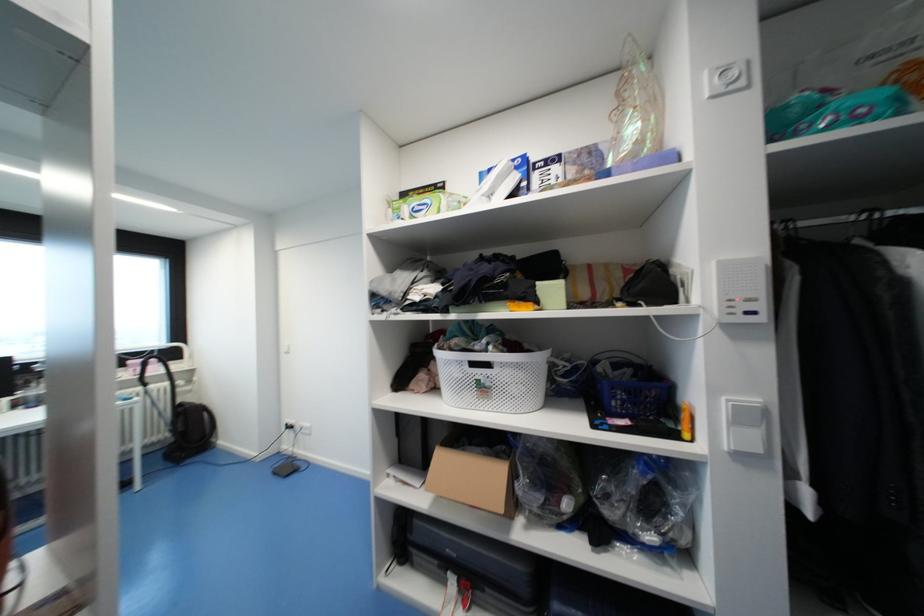
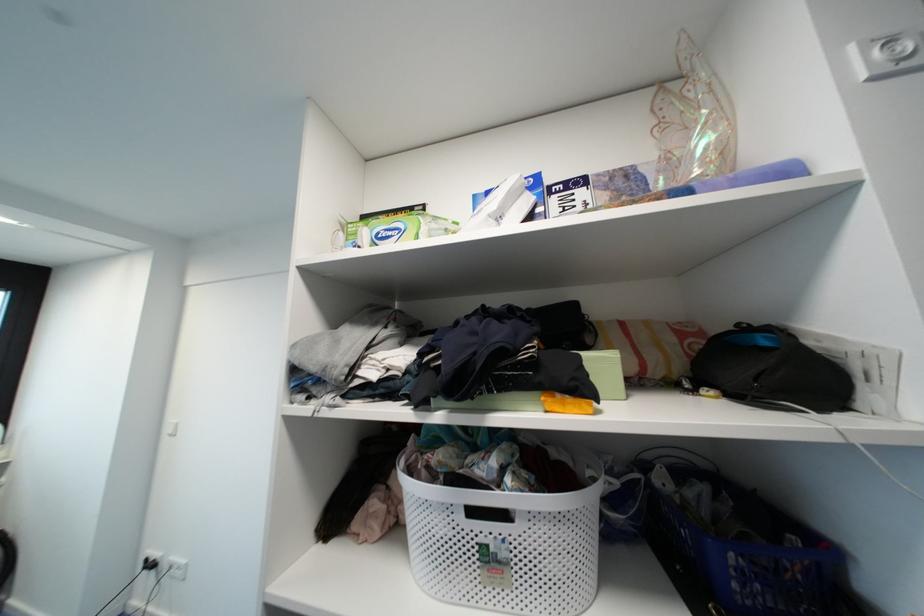
Question: Based on the continuous images, in which direction is the camera rotating? Reply with the corresponding letter.

Choices:
 (A) Left
 (B) Right
 (C) Up
 (D) Down

Answer: (C)